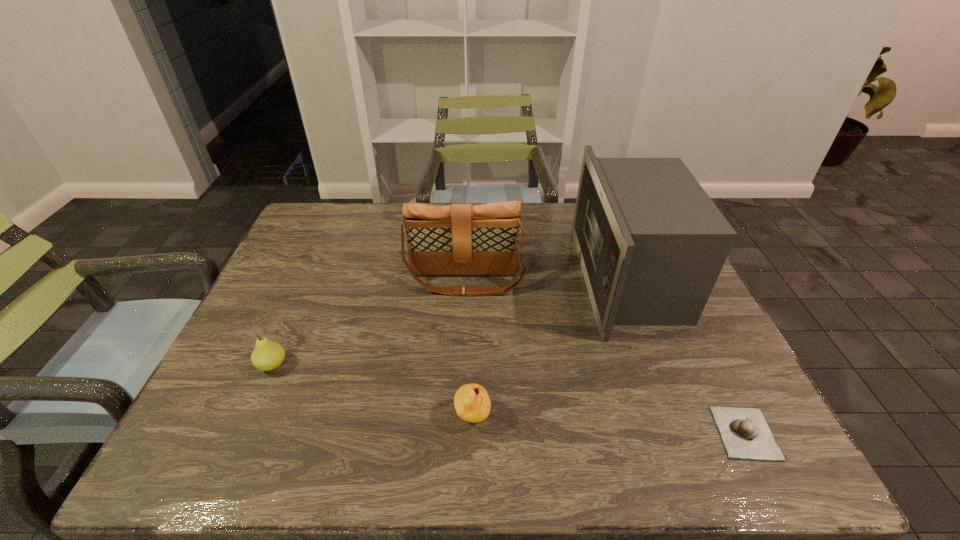
Locate an element on the screen. Image resolution: width=960 pixels, height=540 pixels. the tallest object is located at coordinates (651, 243).

You are a GUI agent. You are given a task and a screenshot of the screen. Output one action in this format:
    pyautogui.click(x=<x>, y=<y>)
    Task: Click on the shoulder bag
    The height and width of the screenshot is (540, 960).
    Given the screenshot: What is the action you would take?
    pyautogui.click(x=458, y=239)

Identify the location of the left pear. The height and width of the screenshot is (540, 960). (267, 355).

Locate an element on the screen. This screenshot has height=540, width=960. the third nearest object is located at coordinates (267, 355).

Where is `the nearer pear`? Image resolution: width=960 pixels, height=540 pixels. the nearer pear is located at coordinates (472, 403).

Find the location of a particular element. Image resolution: width=960 pixels, height=540 pixels. the shortest object is located at coordinates (745, 434).

Identify the location of vacant area situated on the front-facing side of the microwave oven. (450, 279).

At what (x,y) coordinates should I click in order to perform the action: click on blank space located 0.070m on the front-facing side of the microwave oven. Please return your answer as a coordinate pair (x, y). The width and height of the screenshot is (960, 540). Looking at the image, I should click on (557, 279).

Where is `vacant space situated 0.240m on the front-facing side of the microwave oven`? vacant space situated 0.240m on the front-facing side of the microwave oven is located at coordinates (496, 279).

Image resolution: width=960 pixels, height=540 pixels. In order to click on vacant space located on the front-facing side of the shoulder bag in this screenshot , I will do `click(463, 346)`.